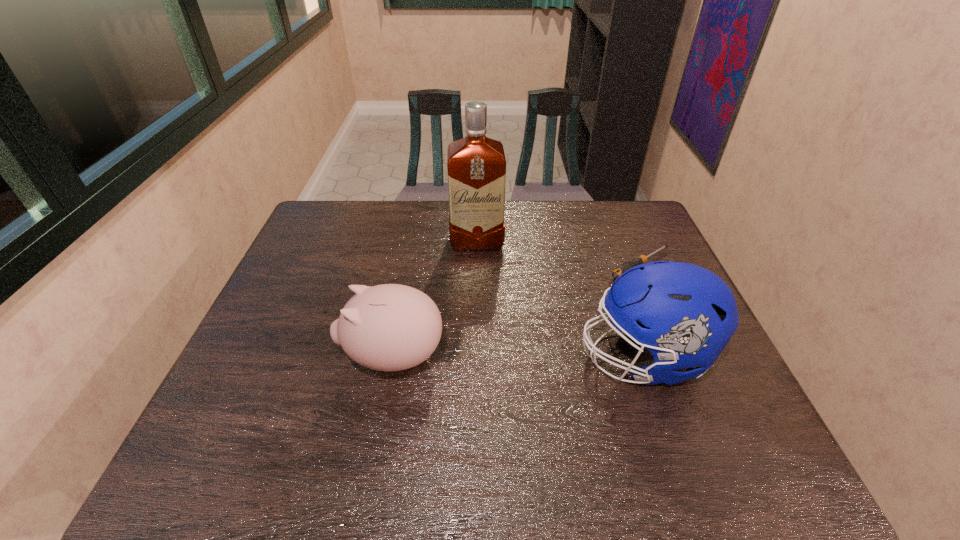
The width and height of the screenshot is (960, 540). Identify the location of object that is at the near right corner. (683, 314).

This screenshot has width=960, height=540. In order to click on vacant space at the far edge of the desktop in this screenshot , I will do `click(372, 233)`.

Locate an element on the screen. vacant space at the left edge of the desktop is located at coordinates (310, 321).

Locate an element on the screen. The image size is (960, 540). vacant position at the right edge of the desktop is located at coordinates [x=630, y=247].

You are a GUI agent. You are given a task and a screenshot of the screen. Output one action in this format:
    pyautogui.click(x=<x>, y=<y>)
    Task: Click on the free space at the far left corner of the desktop
    
    Given the screenshot: What is the action you would take?
    pyautogui.click(x=314, y=226)

What are the coordinates of `unoccupied area between the liquor and the third tallest object` in the screenshot? It's located at (435, 300).

This screenshot has height=540, width=960. In order to click on vacant region between the tallest object and the shortest object in this screenshot , I will do `click(559, 254)`.

Locate an element on the screen. This screenshot has height=540, width=960. free space between the shortest object and the liquor is located at coordinates (559, 254).

Find the location of a particular element. empty location between the shortest object and the liquor is located at coordinates (559, 254).

Where is `free space that is in between the second tallest object and the liquor`? The image size is (960, 540). free space that is in between the second tallest object and the liquor is located at coordinates (560, 300).